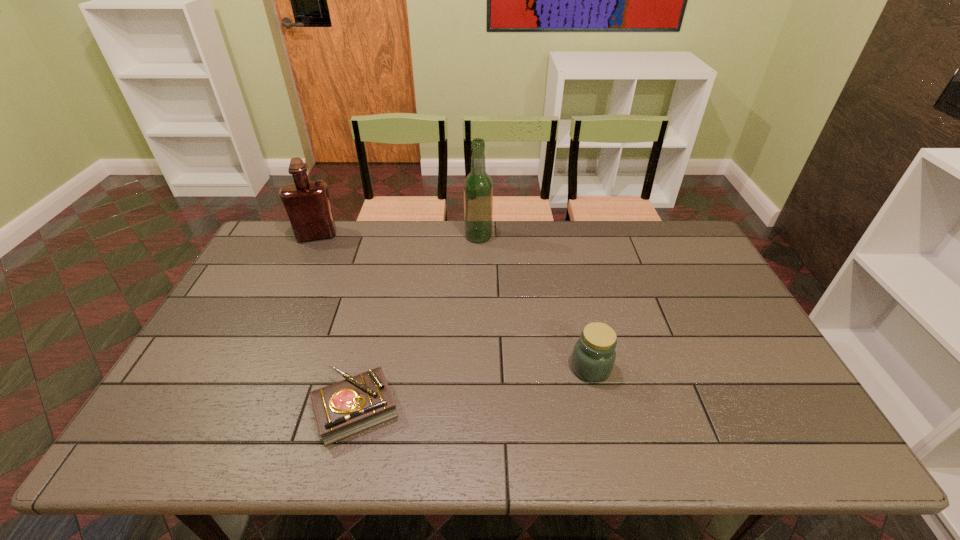
In the image, there is a desktop. In order to click on free space at the far right corner in this screenshot , I will do `click(663, 234)`.

The image size is (960, 540). In order to click on free space between the tallest object and the rightmost object in this screenshot , I will do `click(535, 302)`.

Find the location of a particular element. empty location between the jar and the right liquor is located at coordinates (535, 302).

You are a GUI agent. You are given a task and a screenshot of the screen. Output one action in this format:
    pyautogui.click(x=<x>, y=<y>)
    Task: Click on the vacant area that lies between the left liquor and the third object from right to left
    
    Given the screenshot: What is the action you would take?
    pyautogui.click(x=336, y=322)

Locate an element on the screen. blank region between the third tallest object and the shorter liquor is located at coordinates (454, 301).

I want to click on vacant area that lies between the second tallest object and the second shortest object, so click(x=454, y=301).

Locate an element on the screen. free space between the tallest object and the shorter liquor is located at coordinates (397, 235).

Where is `unoccupied position between the right liquor and the rightmost object`? The image size is (960, 540). unoccupied position between the right liquor and the rightmost object is located at coordinates (535, 302).

Where is `vacant space that is in between the second shortest object and the taller liquor`? This screenshot has height=540, width=960. vacant space that is in between the second shortest object and the taller liquor is located at coordinates (535, 302).

At what (x,y) coordinates should I click in order to perform the action: click on vacant space in between the shortest object and the shorter liquor. Please return your answer as a coordinate pair (x, y). Looking at the image, I should click on (336, 322).